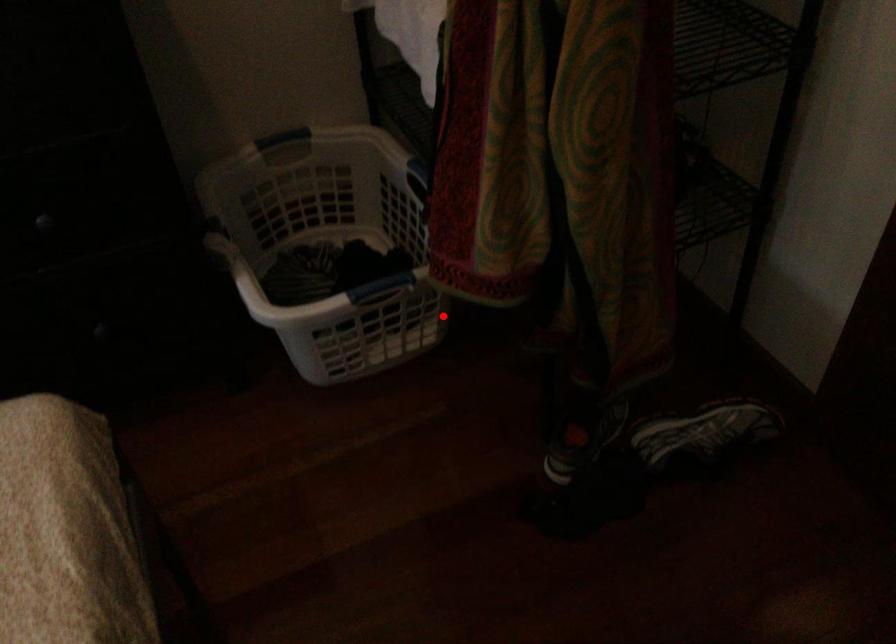
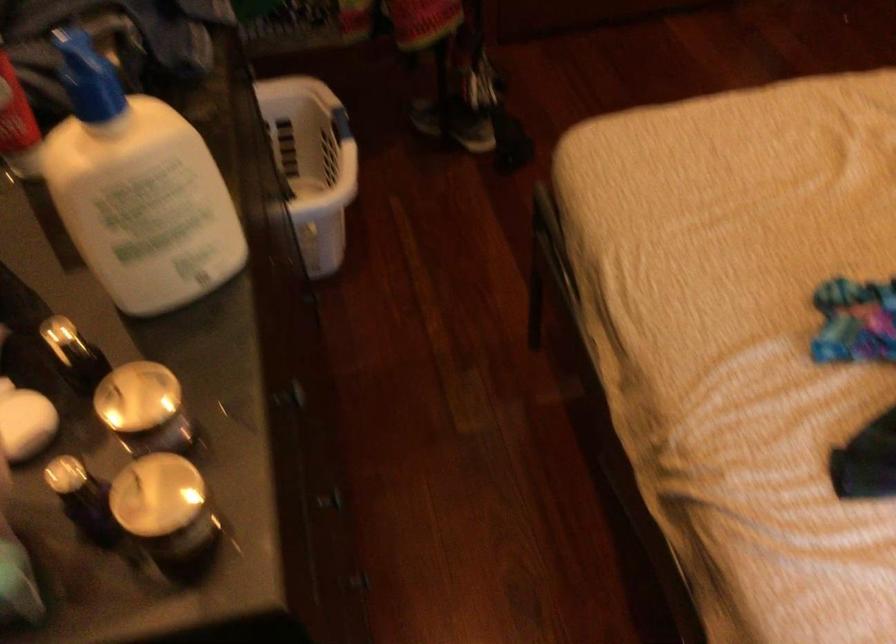
Find the pixel in the second image that matches the highlighted location in the first image.

(312, 164)